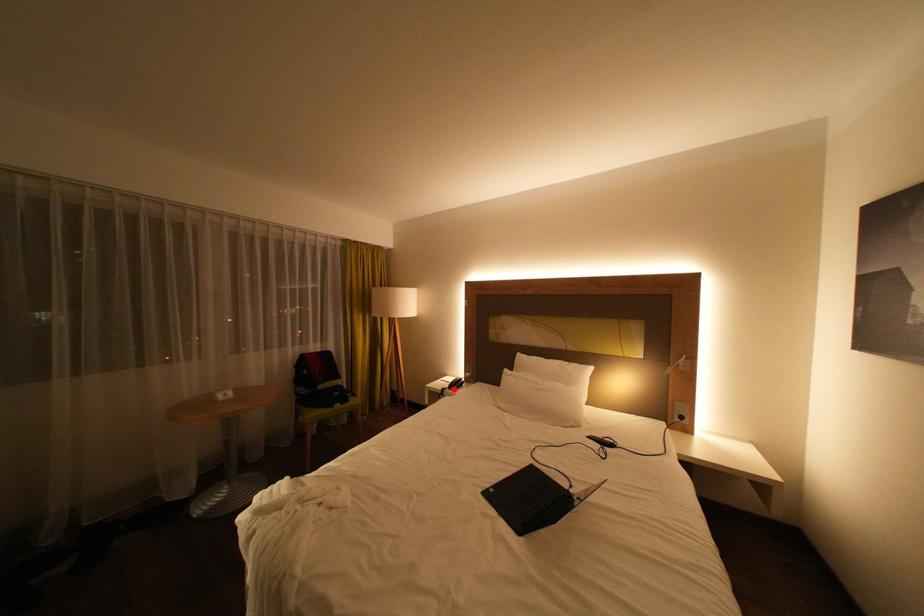
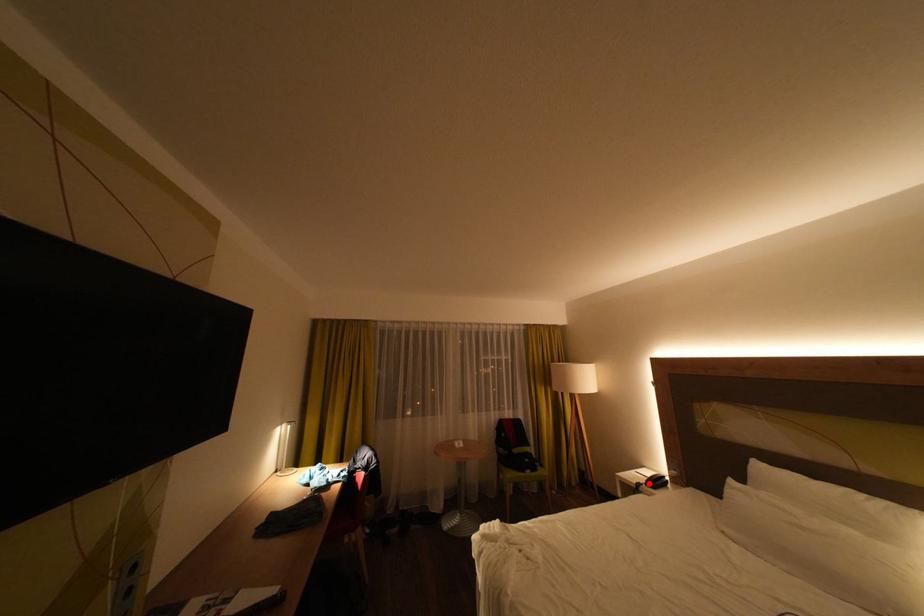
I am providing you with two images of the same scene from different viewpoints. A red point is marked on the first image and another point is marked on the second image. Do the highlighted points in image1 and image2 indicate the same real-world spot?

Yes